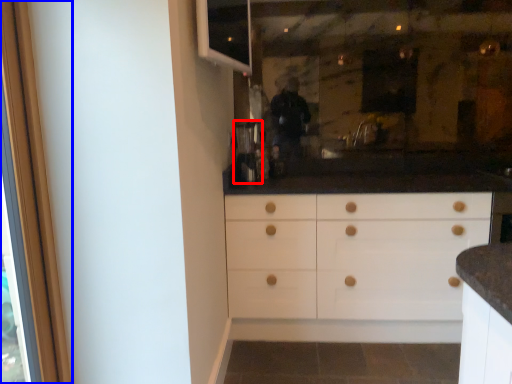
Question: Among these objects, which one is farthest to the camera, coffee machine (highlighted by a red box) or screen door (highlighted by a blue box)?

Choices:
 (A) coffee machine
 (B) screen door

Answer: (A)